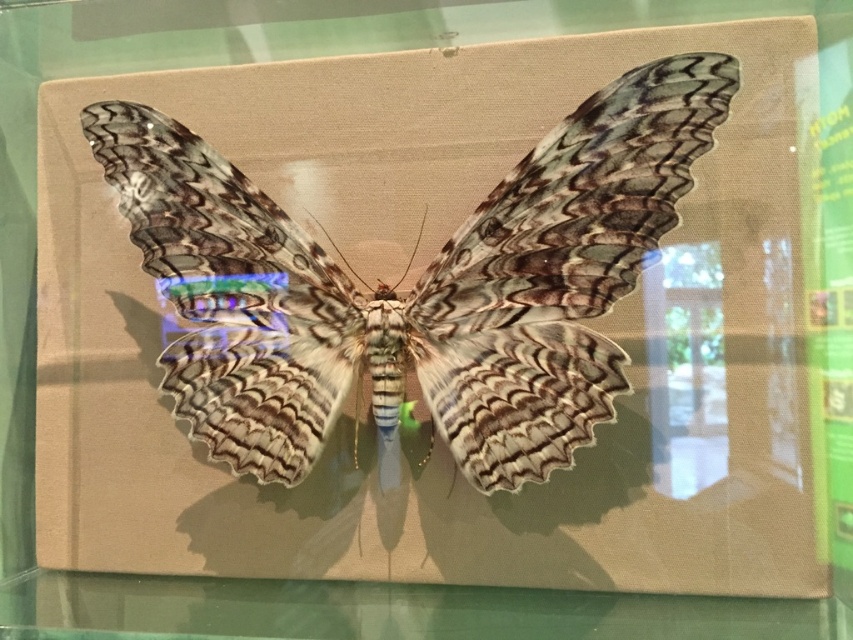
Question: Which point is closer to the camera taking this photo?

Choices:
 (A) (16, 600)
 (B) (508, 236)

Answer: (B)

Question: Which point is closer to the camera taking this photo?

Choices:
 (A) coord(218,595)
 (B) coord(210,440)

Answer: (B)

Question: Which point is farther to the camera?

Choices:
 (A) (277, 323)
 (B) (712, 602)

Answer: (A)

Question: Can you confirm if rustic wood butterfly at center is positioned above transparent glass table at lower center?

Choices:
 (A) no
 (B) yes

Answer: (B)

Question: Does rustic wood butterfly at center have a greater width compared to transparent glass table at lower center?

Choices:
 (A) no
 (B) yes

Answer: (A)

Question: From the image, what is the correct spatial relationship of rustic wood butterfly at center in relation to transparent glass table at lower center?

Choices:
 (A) above
 (B) below

Answer: (A)